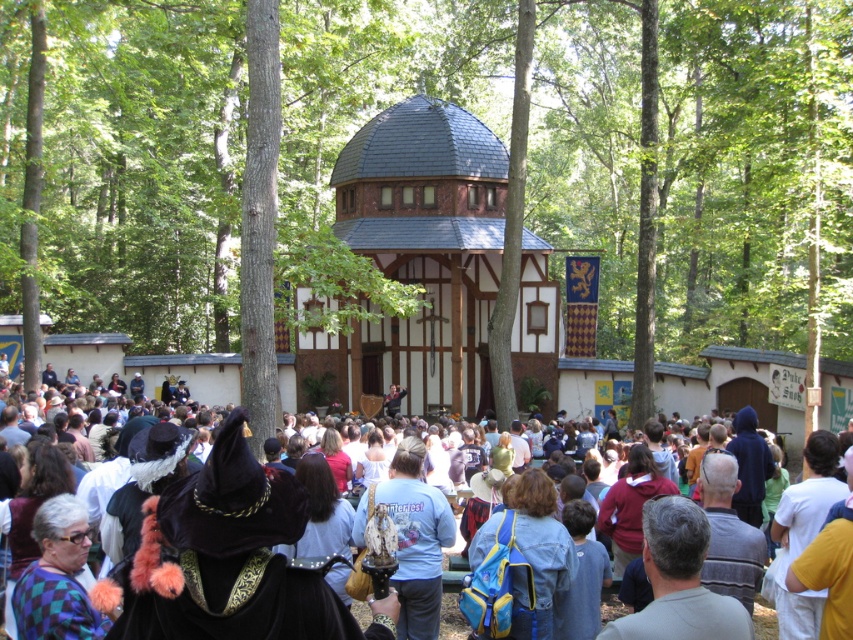
Is brown wood tree at center to the left of velvet hat at center from the viewer's perspective?

Incorrect, brown wood tree at center is not on the left side of velvet hat at center.

Which is behind, point (814, 289) or point (57, 422)?

The point (57, 422) is more distant.

Is point (463, 80) positioned before point (686, 410)?

No, it is not.

You are a GUI agent. You are given a task and a screenshot of the screen. Output one action in this format:
    pyautogui.click(x=<x>, y=<y>)
    Task: Click on the brown wood tree at center
    
    Given the screenshot: What is the action you would take?
    pyautogui.click(x=434, y=186)